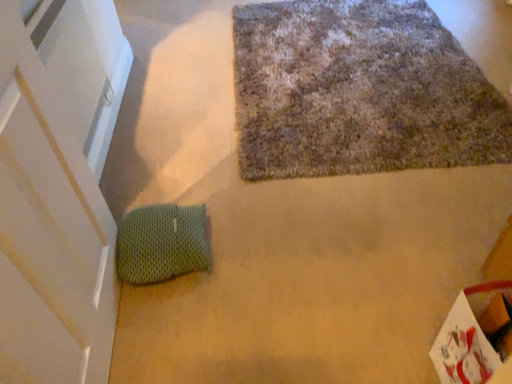
Question: Is green knitted bean bag at lower left aimed at textured woolen mat at upper center?

Choices:
 (A) no
 (B) yes

Answer: (A)

Question: Is green knitted bean bag at lower left not near textured woolen mat at upper center?

Choices:
 (A) yes
 (B) no

Answer: (B)

Question: Does green knitted bean bag at lower left appear on the right side of textured woolen mat at upper center?

Choices:
 (A) yes
 (B) no

Answer: (B)

Question: Is green knitted bean bag at lower left smaller than textured woolen mat at upper center?

Choices:
 (A) yes
 (B) no

Answer: (A)

Question: Considering the relative positions of green knitted bean bag at lower left and textured woolen mat at upper center in the image provided, is green knitted bean bag at lower left behind textured woolen mat at upper center?

Choices:
 (A) yes
 (B) no

Answer: (B)

Question: Can textured woolen mat at upper center be found inside green knitted bean bag at lower left?

Choices:
 (A) yes
 (B) no

Answer: (B)

Question: From the image's perspective, is textured woolen mat at upper center on green knitted bean bag at lower left?

Choices:
 (A) yes
 (B) no

Answer: (A)

Question: From the image's perspective, is textured woolen mat at upper center beneath green knitted bean bag at lower left?

Choices:
 (A) yes
 (B) no

Answer: (B)

Question: Does textured woolen mat at upper center have a lesser height compared to green knitted bean bag at lower left?

Choices:
 (A) no
 (B) yes

Answer: (B)

Question: Is textured woolen mat at upper center positioned beyond the bounds of green knitted bean bag at lower left?

Choices:
 (A) no
 (B) yes

Answer: (B)

Question: Is textured woolen mat at upper center to the right of green knitted bean bag at lower left from the viewer's perspective?

Choices:
 (A) yes
 (B) no

Answer: (A)

Question: Considering the relative positions of textured woolen mat at upper center and green knitted bean bag at lower left in the image provided, is textured woolen mat at upper center to the left of green knitted bean bag at lower left from the viewer's perspective?

Choices:
 (A) yes
 (B) no

Answer: (B)

Question: From the image's perspective, is green knitted bean bag at lower left above or below textured woolen mat at upper center?

Choices:
 (A) above
 (B) below

Answer: (B)